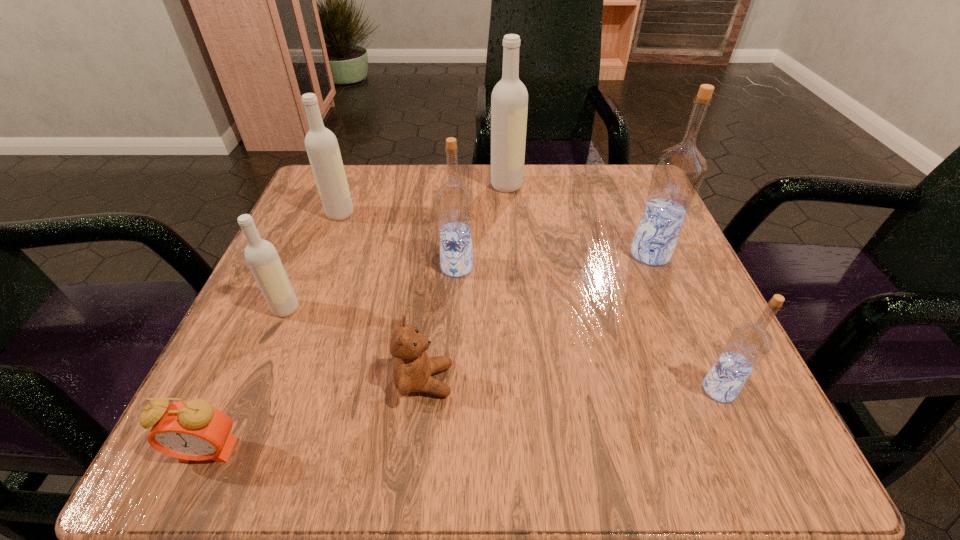
At what (x,y) coordinates should I click in order to perform the action: click on the biggest white vodka. Please return your answer as a coordinate pair (x, y). This screenshot has height=540, width=960. Looking at the image, I should click on (509, 101).

Locate an element on the screen. Image resolution: width=960 pixels, height=540 pixels. the rightmost white vodka is located at coordinates (509, 101).

Identify the location of the biggest blue vodka. (678, 172).

In order to click on the fifth nearest vodka in this screenshot , I will do click(321, 144).

Find the location of `the second smallest white vodka`. the second smallest white vodka is located at coordinates (321, 144).

What are the coordinates of `the fourth vodka from right to left` in the screenshot? It's located at (453, 201).

Identify the location of the leftmost blue vodka. The image size is (960, 540). (453, 201).

The height and width of the screenshot is (540, 960). I want to click on the fifth farthest object, so click(x=261, y=256).

The width and height of the screenshot is (960, 540). I want to click on the nearest white vodka, so click(261, 256).

Where is `the nearest vodka`? the nearest vodka is located at coordinates (748, 344).